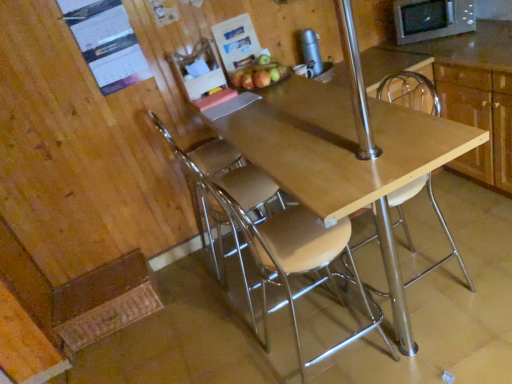
Question: Based on their sizes in the image, would you say shiny red apple at upper center is bigger or smaller than wooden cabinet at upper right?

Choices:
 (A) small
 (B) big

Answer: (A)

Question: From the image's perspective, relative to wooden cabinet at upper right, is shiny red apple at upper center above or below?

Choices:
 (A) below
 (B) above

Answer: (B)

Question: Considering the real-world distances, which object is closest to the metallic silver chair at center, the first chair when ordered from left to right?

Choices:
 (A) shiny red apple at upper center
 (B) metallic silver microwave at upper right
 (C) metallic silver thermos at upper center
 (D) wooden seat at center, which appears as the 2th chair when viewed from the right
 (E) wooden cabinet at upper right

Answer: (D)

Question: Considering the real-world distances, which object is farthest from the shiny red apple at upper center?

Choices:
 (A) wooden seat at center, which is the 2th chair from left to right
 (B) light brown wood chair at center, which appears as the 1th chair when viewed from the right
 (C) wooden cabinet at upper right
 (D) metallic silver thermos at upper center
 (E) metallic silver microwave at upper right

Answer: (C)